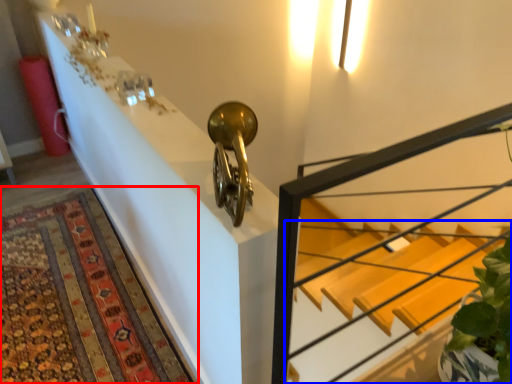
Question: Which point is further to the camera, mat (highlighted by a red box) or stairs (highlighted by a blue box)?

Choices:
 (A) mat
 (B) stairs

Answer: (A)